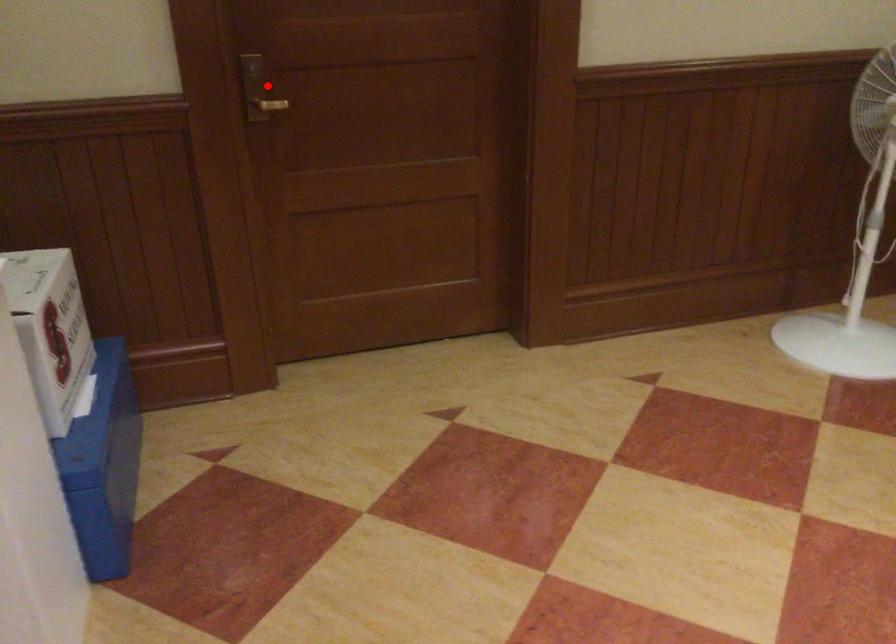
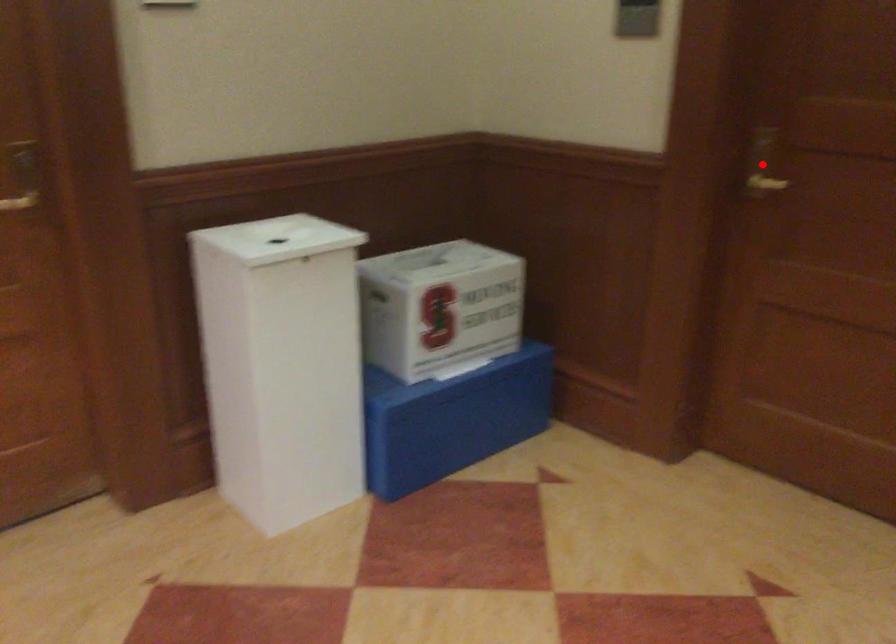
I am providing you with two images of the same scene from different viewpoints. A red point is marked on the first image and another point is marked on the second image. Do the highlighted points in image1 and image2 indicate the same real-world spot?

Yes